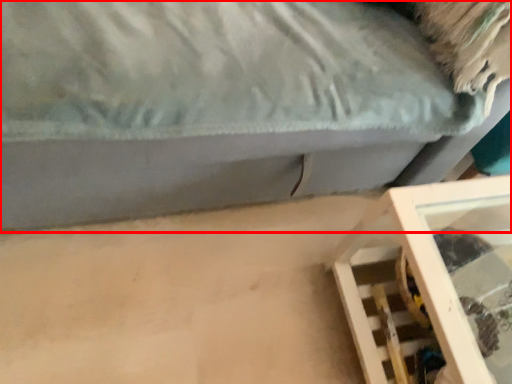
Question: From the image's perspective, where is furniture (annotated by the red box) located relative to furniture?

Choices:
 (A) above
 (B) below

Answer: (A)